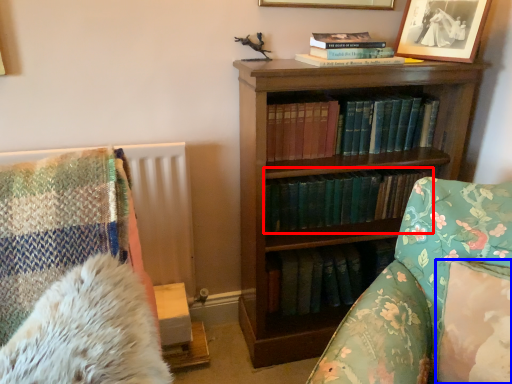
Question: Which object is closer to the camera taking this photo, book (highlighted by a red box) or pillow (highlighted by a blue box)?

Choices:
 (A) book
 (B) pillow

Answer: (B)